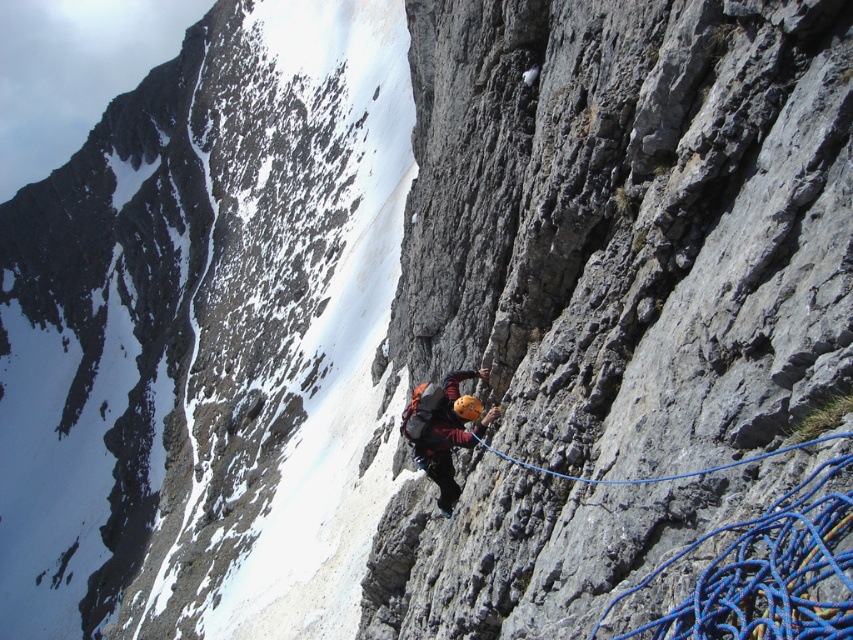
Question: Is orange helmet at center bigger than blue nylon rope at center-right?

Choices:
 (A) no
 (B) yes

Answer: (A)

Question: Is orange helmet at center below blue nylon rope at center-right?

Choices:
 (A) yes
 (B) no

Answer: (A)

Question: Does orange helmet at center have a larger size compared to blue nylon rope at center-right?

Choices:
 (A) yes
 (B) no

Answer: (B)

Question: Which object appears closest to the camera in this image?

Choices:
 (A) orange helmet at center
 (B) blue nylon rope at center-right

Answer: (B)